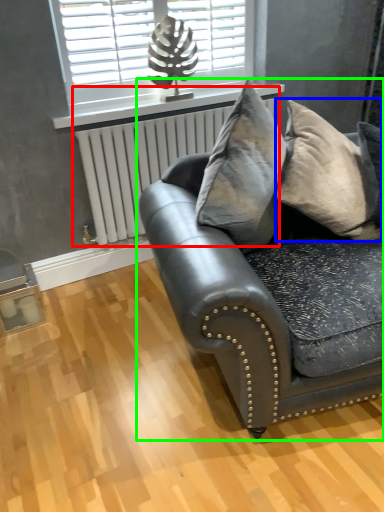
Question: Based on their relative distances, which object is farther from radiator (highlighted by a red box)? Choose from pillow (highlighted by a blue box) and studio couch (highlighted by a green box).

Choices:
 (A) pillow
 (B) studio couch

Answer: (A)